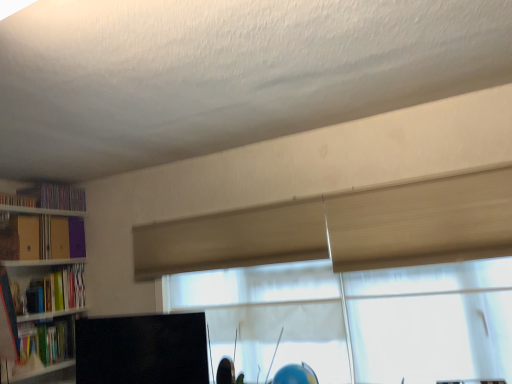
Question: Can you confirm if purple cardboard book at upper left, positioned as the 5th book in bottom-to-top order, is shorter than wooden bookshelf at left?

Choices:
 (A) no
 (B) yes

Answer: (B)

Question: Are purple cardboard book at upper left, positioned as the 5th book in bottom-to-top order, and wooden bookshelf at left beside each other?

Choices:
 (A) no
 (B) yes

Answer: (A)

Question: Is purple cardboard book at upper left, positioned as the 5th book in bottom-to-top order, completely or partially outside of wooden bookshelf at left?

Choices:
 (A) yes
 (B) no

Answer: (A)

Question: Considering the relative sizes of purple cardboard book at upper left, positioned as the 5th book in bottom-to-top order, and wooden bookshelf at left in the image provided, is purple cardboard book at upper left, positioned as the 5th book in bottom-to-top order, wider than wooden bookshelf at left?

Choices:
 (A) yes
 (B) no

Answer: (B)

Question: Is purple cardboard book at upper left, which ranks as the 1th book in top-to-bottom order, taller than wooden bookshelf at left?

Choices:
 (A) no
 (B) yes

Answer: (A)

Question: Does purple cardboard book at upper left, positioned as the 5th book in bottom-to-top order, turn towards wooden bookshelf at left?

Choices:
 (A) no
 (B) yes

Answer: (A)

Question: Is hardcover book at left, positioned as the 4th book in top-to-bottom order, thinner than matte green book at left, which ranks as the 1th book in bottom-to-top order?

Choices:
 (A) yes
 (B) no

Answer: (B)

Question: From a real-world perspective, is hardcover book at left, which appears as the second book when ordered from the bottom, on matte green book at left, placed as the fifth book when sorted from top to bottom?

Choices:
 (A) yes
 (B) no

Answer: (A)

Question: Does hardcover book at left, which appears as the second book when ordered from the bottom, lie in front of matte green book at left, which ranks as the 1th book in bottom-to-top order?

Choices:
 (A) no
 (B) yes

Answer: (A)

Question: Is there a large distance between hardcover book at left, positioned as the 4th book in top-to-bottom order, and matte green book at left, placed as the fifth book when sorted from top to bottom?

Choices:
 (A) yes
 (B) no

Answer: (B)

Question: Considering the relative sizes of hardcover book at left, positioned as the 4th book in top-to-bottom order, and matte green book at left, placed as the fifth book when sorted from top to bottom, in the image provided, is hardcover book at left, positioned as the 4th book in top-to-bottom order, shorter than matte green book at left, placed as the fifth book when sorted from top to bottom,?

Choices:
 (A) no
 (B) yes

Answer: (A)

Question: From the image's perspective, is hardcover book at left, which appears as the second book when ordered from the bottom, beneath matte green book at left, placed as the fifth book when sorted from top to bottom?

Choices:
 (A) no
 (B) yes

Answer: (A)

Question: Is translucent fabric window at center positioned before matte green book at left, which ranks as the 1th book in bottom-to-top order?

Choices:
 (A) yes
 (B) no

Answer: (A)